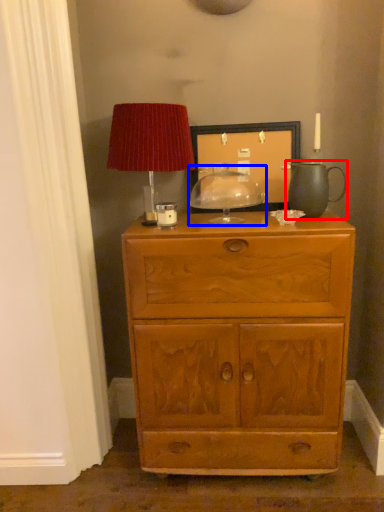
Question: Which object is further to the camera taking this photo, tea pot (highlighted by a red box) or candle holder (highlighted by a blue box)?

Choices:
 (A) tea pot
 (B) candle holder

Answer: (B)